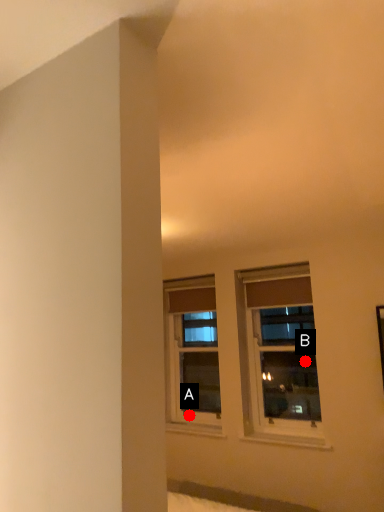
Question: Two points are circled on the image, labeled by A and B beside each circle. Which point is farther to the camera?

Choices:
 (A) A is further
 (B) B is further

Answer: (A)